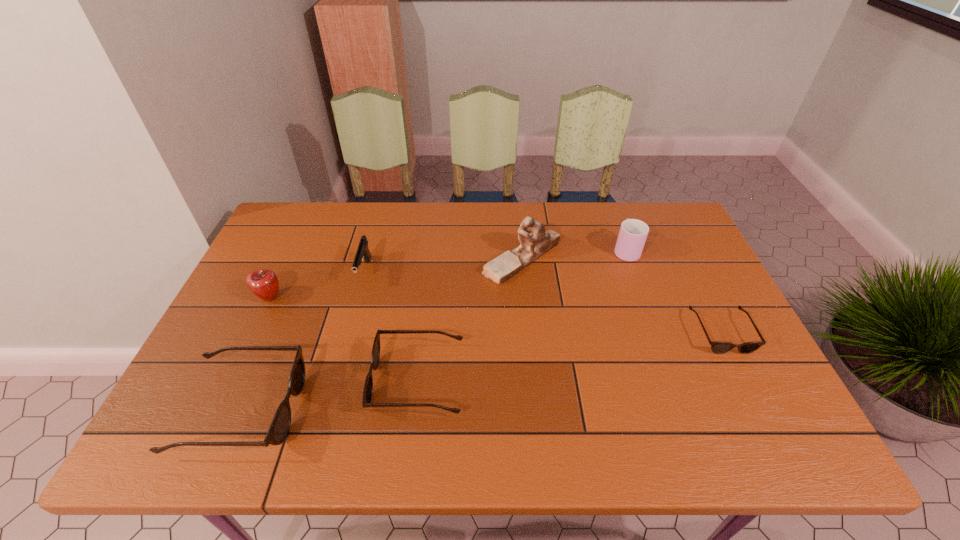
The width and height of the screenshot is (960, 540). In the image, there is a desktop. Find the location of `vacant space at the near edge`. vacant space at the near edge is located at coordinates (343, 403).

You are a GUI agent. You are given a task and a screenshot of the screen. Output one action in this format:
    pyautogui.click(x=<x>, y=<y>)
    Task: Click on the free space at the left edge of the desktop
    This screenshot has width=960, height=540.
    Given the screenshot: What is the action you would take?
    pyautogui.click(x=240, y=357)

You are a GUI agent. You are given a task and a screenshot of the screen. Output one action in this format:
    pyautogui.click(x=<x>, y=<y>)
    Task: Click on the vacant region at the far left corner of the desktop
    The width and height of the screenshot is (960, 540).
    Given the screenshot: What is the action you would take?
    pyautogui.click(x=289, y=210)

At what (x,y) coordinates should I click in order to perform the action: click on vacant region between the apple and the sixth object from left to right. Please return your answer as a coordinate pair (x, y). The image size is (960, 540). Looking at the image, I should click on (447, 274).

The width and height of the screenshot is (960, 540). I want to click on free space between the rightmost sunglasses and the apple, so pos(495,315).

Identify the location of free point between the apple and the second sunglasses from left to right. (344, 339).

Find the location of a particular element. This screenshot has width=960, height=540. free space that is in between the leftmost sunglasses and the second shortest object is located at coordinates (330, 395).

Find the location of a particular element. unoccupied area between the third object from left to right and the rightmost sunglasses is located at coordinates (543, 302).

The width and height of the screenshot is (960, 540). I want to click on free space between the apple and the second sunglasses from left to right, so click(344, 339).

You are a GUI agent. You are given a task and a screenshot of the screen. Output one action in this format:
    pyautogui.click(x=<x>, y=<y>)
    Task: Click on the vacant space that's between the pistol and the rightmost object
    
    Given the screenshot: What is the action you would take?
    pyautogui.click(x=543, y=302)